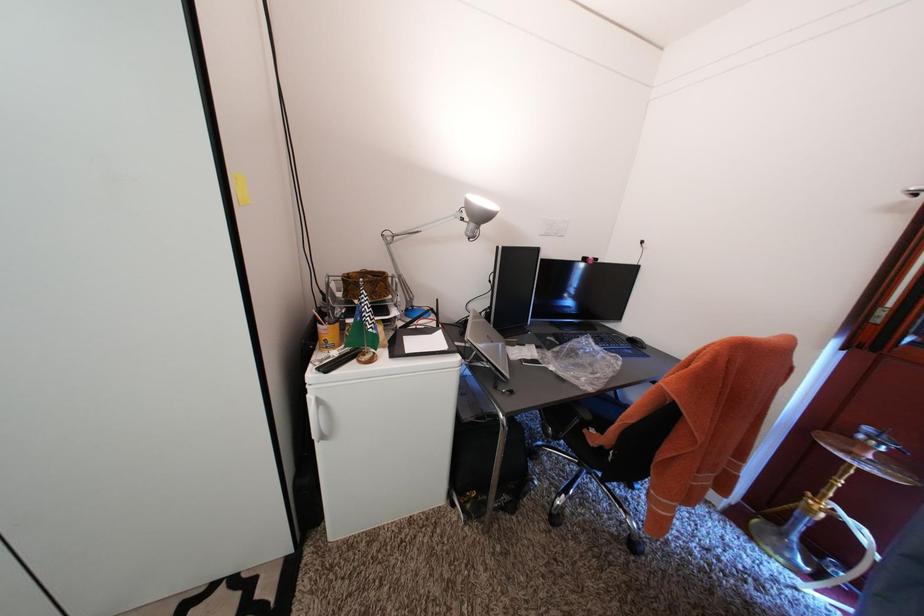
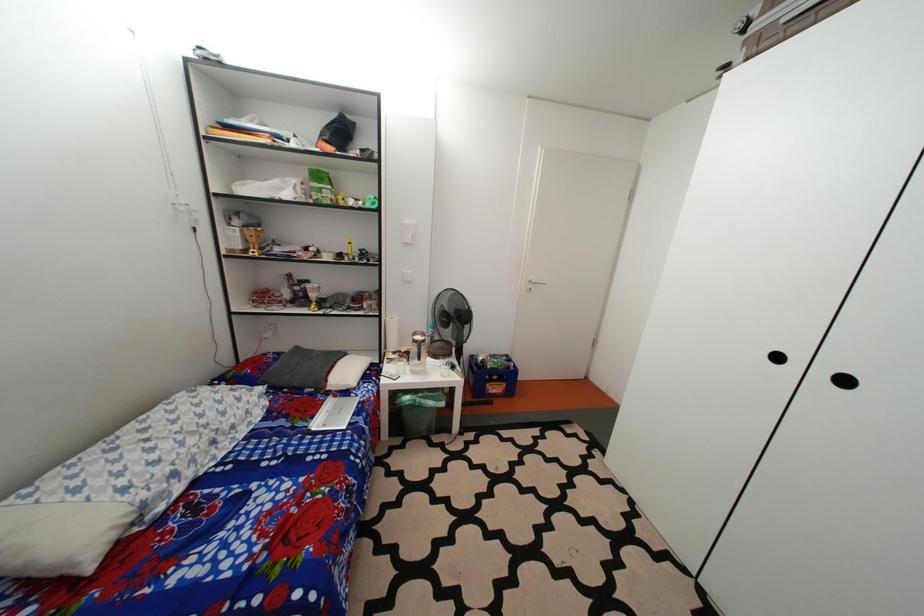
Question: The camera is either moving clockwise (left) or counter-clockwise (right) around the object. The first image is from the beginning of the video and the second image is from the end. Is the camera moving left or right when shooting the video?

Choices:
 (A) Left
 (B) Right

Answer: (B)